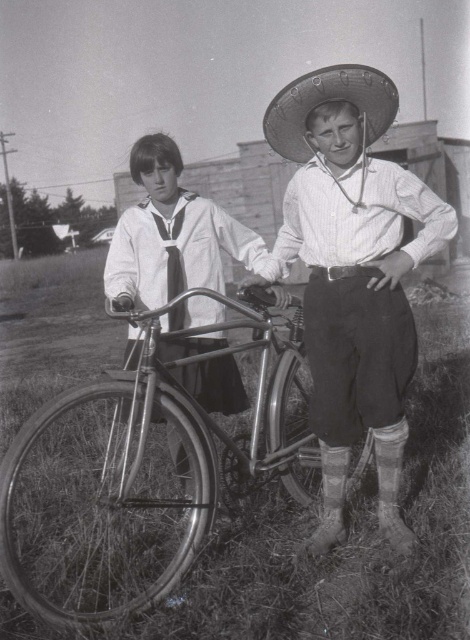
What are the coordinates of the shiny chrome bicycle at center?

The coordinates of the shiny chrome bicycle at center are at point (139, 470).

You are a photographer adjusting the focus on your camera. You want to take a clear photo of both the white striped shirt at center and the satin necktie at center. If your camera can only focus on objects within a 25 inch range, will both items be in focus?

The white striped shirt at center is 28.87 inches away from the satin necktie at center, which exceeds the camera focus range of 25 inches. Therefore, both items cannot be in focus simultaneously.

You are a photographer trying to capture a closeup of the shiny chrome bicycle at center and the smooth fabric sailor suit at center in the image. Given that your camera can only focus on objects within 30 inches of each other, will you be able to take a clear photo of both subjects together?

The shiny chrome bicycle at center and smooth fabric sailor suit at center are 33.03 inches apart from each other. Since the camera requires objects to be within 30 inches for clear focus, the distance between them exceeds the camera limit. Therefore, the photographer cannot take a clear photo of both subjects together.